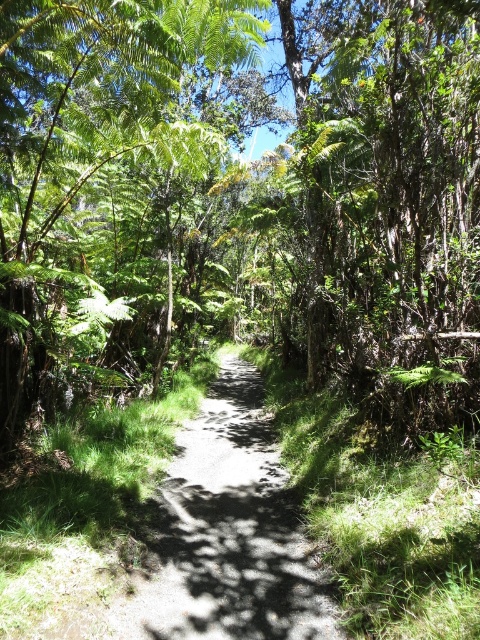
Can you confirm if green leafy tree at center is taller than dirt path at center?

Correct, green leafy tree at center is much taller as dirt path at center.

Is green leafy tree at center shorter than dirt path at center?

In fact, green leafy tree at center may be taller than dirt path at center.

Which is in front, point (264, 300) or point (179, 472)?

Positioned in front is point (179, 472).

This screenshot has height=640, width=480. What are the coordinates of `green leafy tree at center` in the screenshot? It's located at (239, 184).